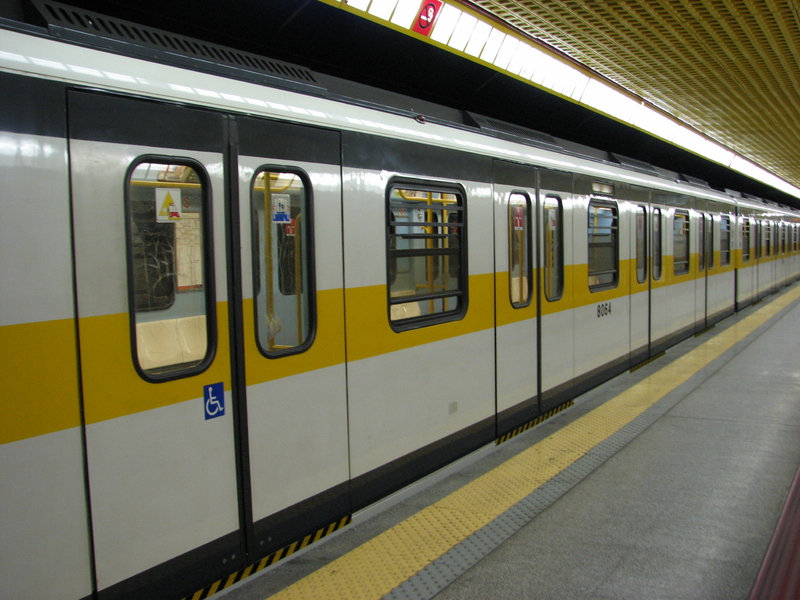
Locate an element on the screen. light is located at coordinates (433, 28).